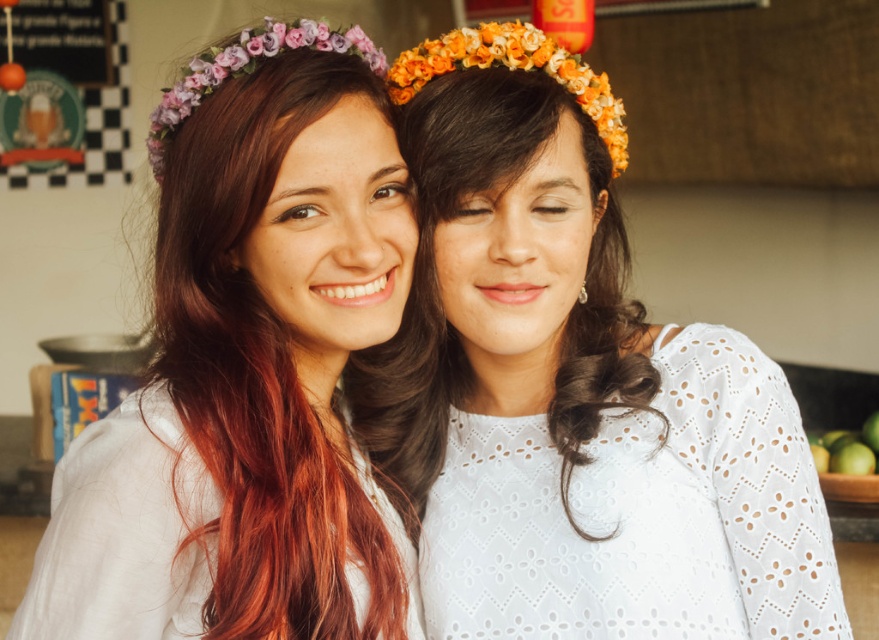
Is matte floral crown at upper left positioned at the back of green matte apples at lower right?

No, it is not.

Is point (35, 568) behind point (838, 472)?

No, it is not.

Locate an element on the screen. The width and height of the screenshot is (879, 640). matte floral crown at upper left is located at coordinates (248, 369).

The height and width of the screenshot is (640, 879). Describe the element at coordinates (441, 301) in the screenshot. I see `dark brown silky hair at center` at that location.

Who is positioned more to the left, dark brown silky hair at center or green matte apples at lower right?

→ From the viewer's perspective, dark brown silky hair at center appears more on the left side.

Is point (380, 433) positioned behind point (819, 440)?

No, it is in front of (819, 440).

Image resolution: width=879 pixels, height=640 pixels. What are the coordinates of `dark brown silky hair at center` in the screenshot? It's located at (441, 301).

Can you confirm if matte floral crown at upper left is positioned to the right of dark brown silky hair at center?

Incorrect, matte floral crown at upper left is not on the right side of dark brown silky hair at center.

The image size is (879, 640). What do you see at coordinates (248, 369) in the screenshot?
I see `matte floral crown at upper left` at bounding box center [248, 369].

You are a GUI agent. You are given a task and a screenshot of the screen. Output one action in this format:
    pyautogui.click(x=<x>, y=<y>)
    Task: Click on the matte floral crown at upper left
    This screenshot has height=640, width=879.
    Given the screenshot: What is the action you would take?
    pyautogui.click(x=248, y=369)